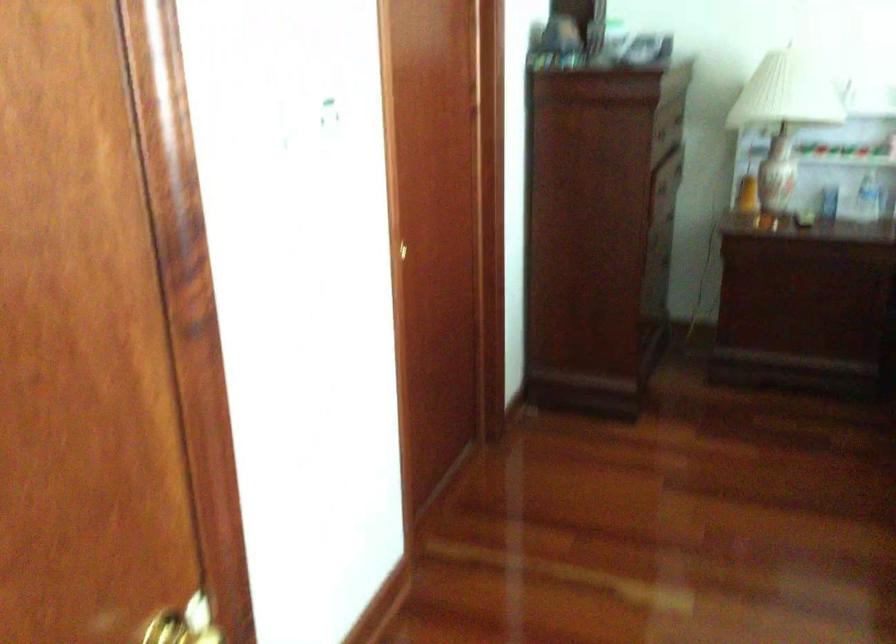
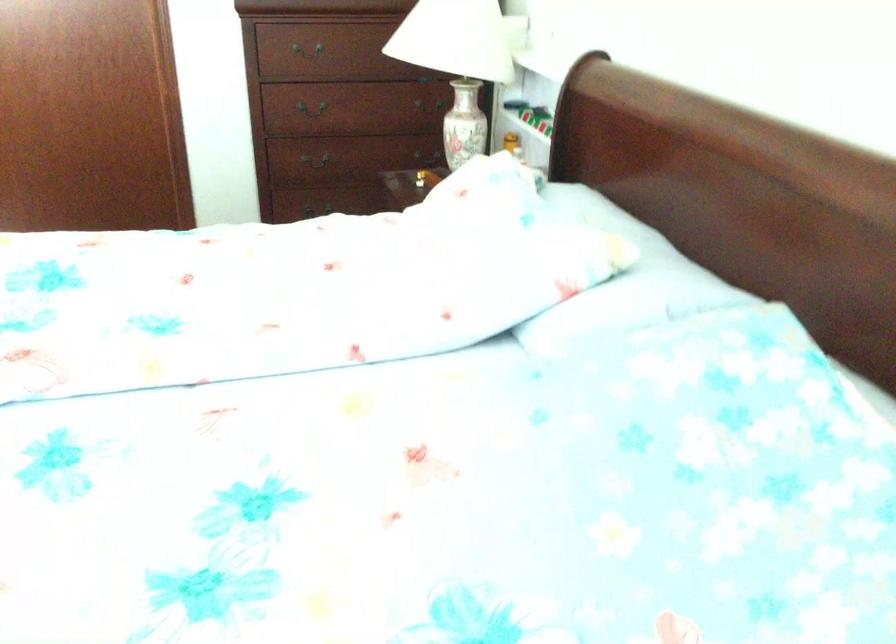
The point at (604, 200) is marked in the first image. Where is the corresponding point in the second image?

(313, 108)